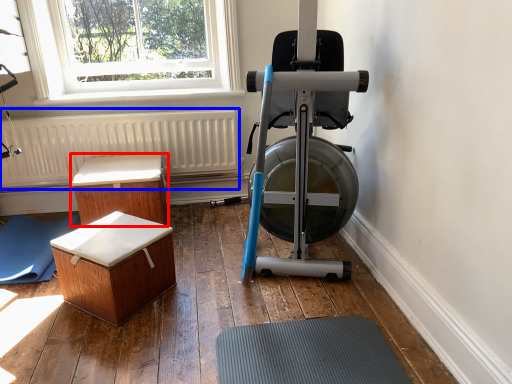
Question: Which object appears farthest to the camera in this image, furniture (highlighted by a red box) or radiator (highlighted by a blue box)?

Choices:
 (A) furniture
 (B) radiator

Answer: (B)